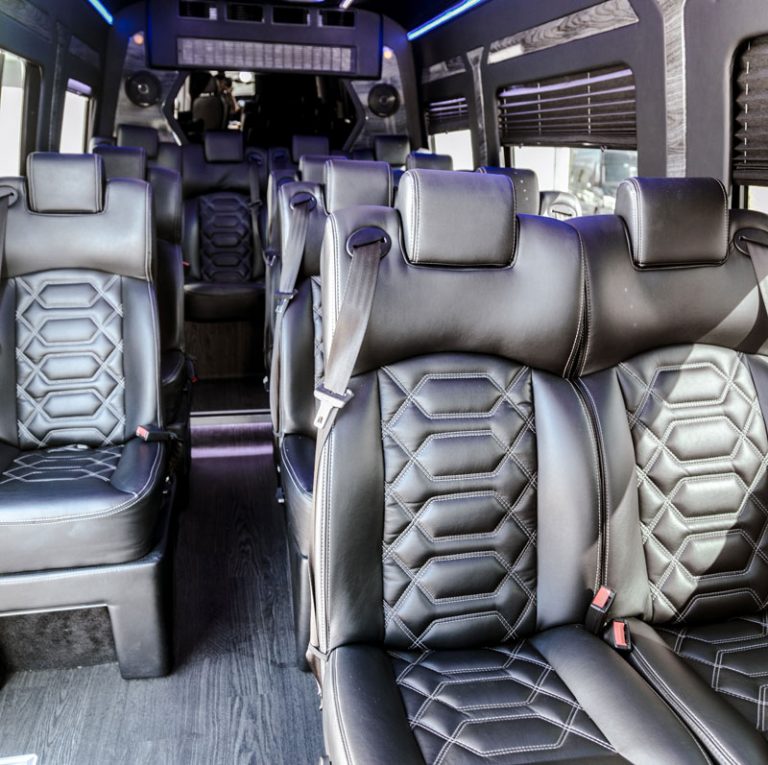
What are the coordinates of `latch plates` in the screenshot? It's located at (319, 405), (286, 301).